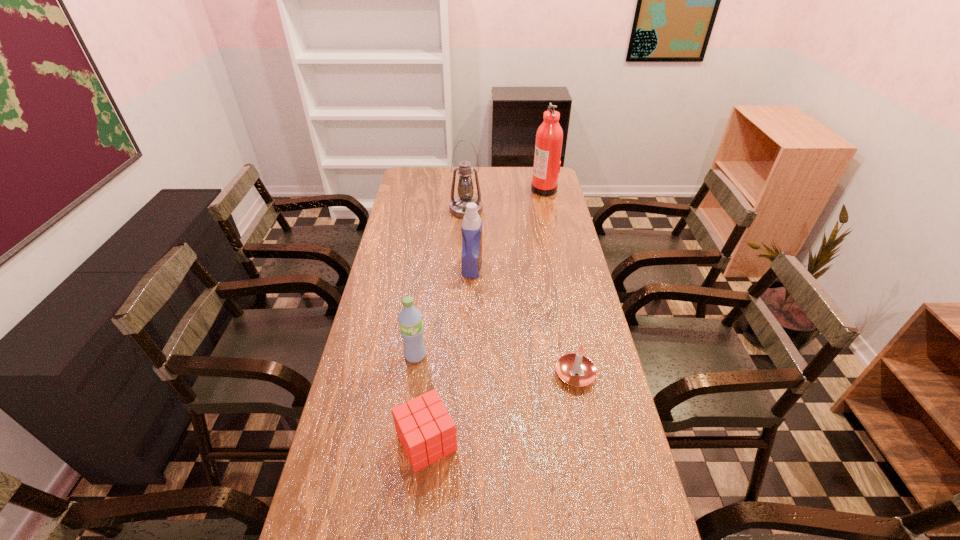
The image size is (960, 540). Identify the location of object that ranks as the third closest to the oil lamp. click(410, 321).

What are the coordinates of `object that is the closest to the water bottle` in the screenshot? It's located at (427, 432).